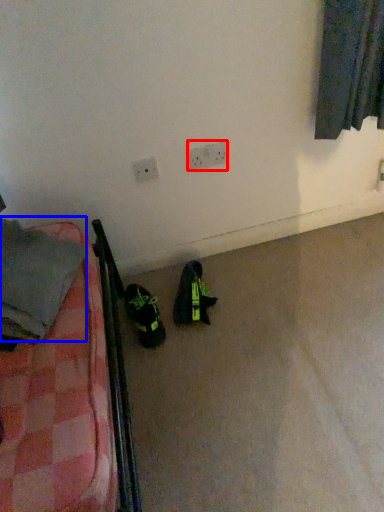
Question: Which point is closer to the camera, electric outlet (highlighted by a red box) or clothing (highlighted by a blue box)?

Choices:
 (A) electric outlet
 (B) clothing

Answer: (B)